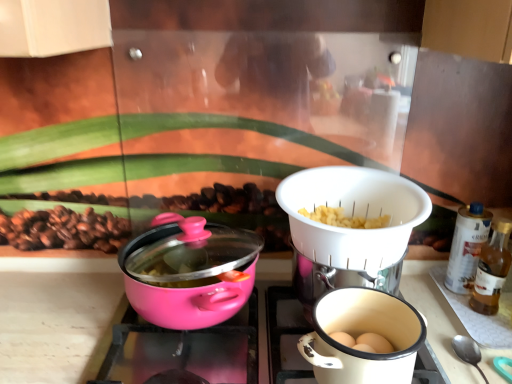
Describe the element at coordinates (189, 271) in the screenshot. This screenshot has width=512, height=384. I see `pink matte pot at center, acting as the second kitchen appliance starting from the right` at that location.

Find the location of `pink matte pot at center, acting as the second kitchen appliance starting from the right`. pink matte pot at center, acting as the second kitchen appliance starting from the right is located at coordinates (189, 271).

Where is `translucent glass bottle at right`? translucent glass bottle at right is located at coordinates (492, 269).

What do you see at coordinates (492, 269) in the screenshot? I see `translucent glass bottle at right` at bounding box center [492, 269].

Find the location of a particular element. pink glossy pot at center is located at coordinates (174, 351).

Would you consider matte white coffee cup at lower right to be distant from pink glossy pot at center?

matte white coffee cup at lower right is actually quite close to pink glossy pot at center.

Does matte white coffee cup at lower right turn towards pink glossy pot at center?

No, matte white coffee cup at lower right is not turned towards pink glossy pot at center.

Does matte white coffee cup at lower right come in front of pink glossy pot at center?

Yes, matte white coffee cup at lower right is closer to the viewer.

From the picture: Measure the distance between matte white coffee cup at lower right and pink glossy pot at center.

They are 6.42 inches apart.

Measure the distance from pink matte pot at center, acting as the second kitchen appliance starting from the right, to pink glossy pot at center.

A distance of 4.65 inches exists between pink matte pot at center, acting as the second kitchen appliance starting from the right, and pink glossy pot at center.

Does pink matte pot at center, acting as the second kitchen appliance starting from the right, have a lesser width compared to pink glossy pot at center?

Yes.

Between point (227, 244) and point (215, 381), which one is positioned behind?

Point (227, 244)

Based on the photo, between pink matte pot at center, the first kitchen appliance when ordered from left to right, and pink glossy pot at center, which one is positioned behind?

pink glossy pot at center is further away from the camera.

Can you confirm if white plastic strainer at center, which is counted as the 1th kitchen appliance, starting from the right, is positioned to the left of pink glossy pot at center?

No, white plastic strainer at center, which is counted as the 1th kitchen appliance, starting from the right, is not to the left of pink glossy pot at center.

Would you say white plastic strainer at center, which is counted as the 1th kitchen appliance, starting from the right, is inside or outside pink glossy pot at center?

white plastic strainer at center, which is counted as the 1th kitchen appliance, starting from the right, is outside pink glossy pot at center.

In terms of height, does white plastic strainer at center, which is counted as the 1th kitchen appliance, starting from the right, look taller or shorter compared to pink glossy pot at center?

white plastic strainer at center, which is counted as the 1th kitchen appliance, starting from the right, is taller than pink glossy pot at center.

Is point (394, 341) positioned in front of point (187, 220)?

Yes, point (394, 341) is in front of point (187, 220).

How different are the orientations of matte white coffee cup at lower right and pink matte pot at center, the first kitchen appliance when ordered from left to right, in degrees?

matte white coffee cup at lower right and pink matte pot at center, the first kitchen appliance when ordered from left to right, are facing 0.00138 degrees away from each other.

Is matte white coffee cup at lower right wider than pink matte pot at center, the first kitchen appliance when ordered from left to right?

Incorrect, the width of matte white coffee cup at lower right does not surpass that of pink matte pot at center, the first kitchen appliance when ordered from left to right.

Is white plastic strainer at center, which is counted as the 1th kitchen appliance, starting from the right, positioned with its back to translucent glass bottle at right?

No, white plastic strainer at center, which is counted as the 1th kitchen appliance, starting from the right,'s orientation is not away from translucent glass bottle at right.

Between white plastic strainer at center, which is counted as the 1th kitchen appliance, starting from the right, and translucent glass bottle at right, which one has smaller width?

translucent glass bottle at right.

Which is in front, point (411, 194) or point (481, 252)?

The point (411, 194) is closer to the camera.

Is white plastic strainer at center, which is counted as the 1th kitchen appliance, starting from the right, to the left of translucent glass bottle at right from the viewer's perspective?

Indeed, white plastic strainer at center, which is counted as the 1th kitchen appliance, starting from the right, is positioned on the left side of translucent glass bottle at right.

Is translucent glass bottle at right looking in the opposite direction of matte white coffee cup at lower right?

That's not correct — translucent glass bottle at right is not looking away from matte white coffee cup at lower right.

From the image's perspective, is translucent glass bottle at right located above matte white coffee cup at lower right?

Yes.

Between translucent glass bottle at right and pink glossy pot at center, which one has less height?

With less height is pink glossy pot at center.

Considering the relative positions of translucent glass bottle at right and pink glossy pot at center in the image provided, is translucent glass bottle at right behind pink glossy pot at center?

Yes.

Is translucent glass bottle at right bigger than pink glossy pot at center?

Incorrect, translucent glass bottle at right is not larger than pink glossy pot at center.

The width and height of the screenshot is (512, 384). Find the location of `coffee cup above the pink glossy pot at center (from the image's perspective)`. coffee cup above the pink glossy pot at center (from the image's perspective) is located at coordinates (361, 333).

Locate an element on the screen. The width and height of the screenshot is (512, 384). gas stove below the pink matte pot at center, the first kitchen appliance when ordered from left to right (from a real-world perspective) is located at coordinates (174, 351).

From the image, which object appears to be nearer to matte white coffee cup at lower right, white plastic strainer at center, which is counted as the 1th kitchen appliance, starting from the right, or pink matte pot at center, acting as the second kitchen appliance starting from the right?

white plastic strainer at center, which is counted as the 1th kitchen appliance, starting from the right, is closer to matte white coffee cup at lower right.

Which object lies further to the anchor point white plastic strainer at center, marked as the 2th kitchen appliance in a left-to-right arrangement, translucent glass bottle at right or pink glossy pot at center?

Based on the image, translucent glass bottle at right appears to be further to white plastic strainer at center, marked as the 2th kitchen appliance in a left-to-right arrangement.

Based on their spatial positions, is pink glossy pot at center or matte white coffee cup at lower right closer to translucent glass bottle at right?

matte white coffee cup at lower right lies closer to translucent glass bottle at right than the other object.

Considering their positions, is pink matte pot at center, acting as the second kitchen appliance starting from the right, positioned further to translucent glass bottle at right than matte white coffee cup at lower right?

pink matte pot at center, acting as the second kitchen appliance starting from the right.

Based on their spatial positions, is translucent glass bottle at right or white plastic strainer at center, which is counted as the 1th kitchen appliance, starting from the right, further from pink matte pot at center, the first kitchen appliance when ordered from left to right?

Based on the image, translucent glass bottle at right appears to be further to pink matte pot at center, the first kitchen appliance when ordered from left to right.

From the image, which object appears to be nearer to translucent glass bottle at right, white plastic strainer at center, which is counted as the 1th kitchen appliance, starting from the right, or matte white coffee cup at lower right?

white plastic strainer at center, which is counted as the 1th kitchen appliance, starting from the right, is closer to translucent glass bottle at right.

Estimate the real-world distances between objects in this image. Which object is further from pink matte pot at center, acting as the second kitchen appliance starting from the right, translucent glass bottle at right or matte white coffee cup at lower right?

translucent glass bottle at right lies further to pink matte pot at center, acting as the second kitchen appliance starting from the right, than the other object.

When comparing their distances from white plastic strainer at center, marked as the 2th kitchen appliance in a left-to-right arrangement, does translucent glass bottle at right or pink matte pot at center, acting as the second kitchen appliance starting from the right, seem closer?

Based on the image, pink matte pot at center, acting as the second kitchen appliance starting from the right, appears to be nearer to white plastic strainer at center, marked as the 2th kitchen appliance in a left-to-right arrangement.

Find the location of a particular element. gas stove between pink matte pot at center, the first kitchen appliance when ordered from left to right, and matte white coffee cup at lower right from left to right is located at coordinates (174, 351).

Find the location of a particular element. gas stove between pink matte pot at center, acting as the second kitchen appliance starting from the right, and white plastic strainer at center, marked as the 2th kitchen appliance in a left-to-right arrangement, in the horizontal direction is located at coordinates (174, 351).

Where is `coffee cup between pink matte pot at center, the first kitchen appliance when ordered from left to right, and white plastic strainer at center, marked as the 2th kitchen appliance in a left-to-right arrangement`? Image resolution: width=512 pixels, height=384 pixels. coffee cup between pink matte pot at center, the first kitchen appliance when ordered from left to right, and white plastic strainer at center, marked as the 2th kitchen appliance in a left-to-right arrangement is located at coordinates (361, 333).

Where is `coffee cup located between pink matte pot at center, the first kitchen appliance when ordered from left to right, and translucent glass bottle at right in the left-right direction`? This screenshot has width=512, height=384. coffee cup located between pink matte pot at center, the first kitchen appliance when ordered from left to right, and translucent glass bottle at right in the left-right direction is located at coordinates [361, 333].